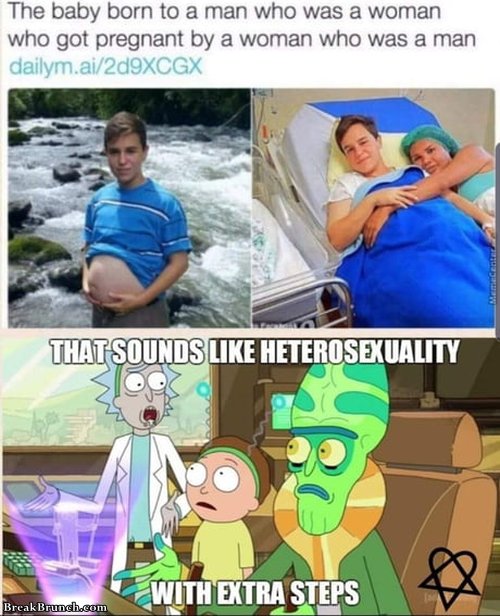
Where is `hospital bed`? hospital bed is located at coordinates (393, 122).